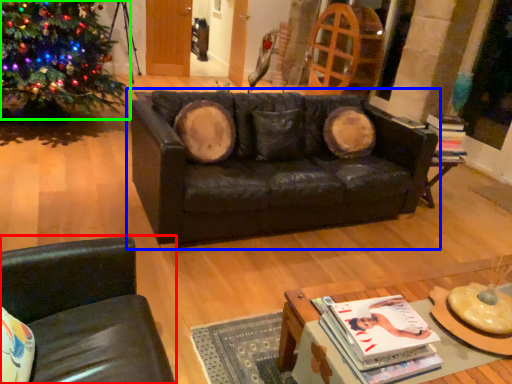
Question: Estimate the real-world distances between objects in this image. Which object is farther from chair (highlighted by a red box), studio couch (highlighted by a blue box) or christmas tree (highlighted by a green box)?

Choices:
 (A) studio couch
 (B) christmas tree

Answer: (B)